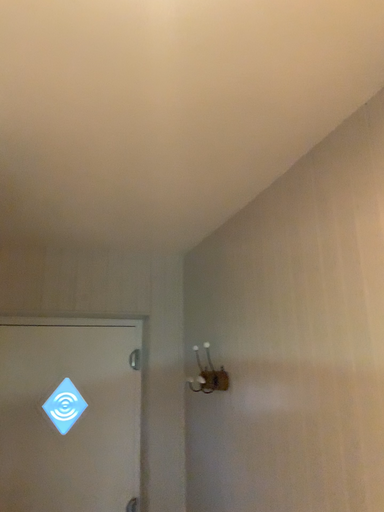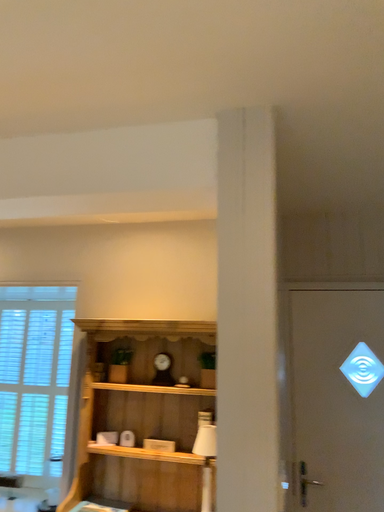
Question: How did the camera likely rotate when shooting the video?

Choices:
 (A) rotated downward
 (B) rotated upward

Answer: (A)